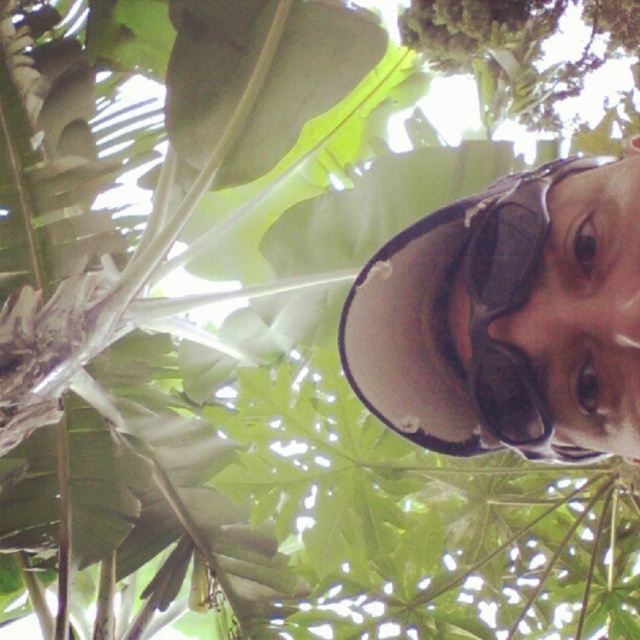
Question: Which object appears closest to the camera in this image?

Choices:
 (A) black matte goggles at upper right
 (B) white matte hat at upper center

Answer: (B)

Question: Is white matte hat at upper center thinner than black matte goggles at upper right?

Choices:
 (A) no
 (B) yes

Answer: (A)

Question: Can you confirm if white matte hat at upper center is thinner than black matte goggles at upper right?

Choices:
 (A) no
 (B) yes

Answer: (A)

Question: Does white matte hat at upper center appear under black matte goggles at upper right?

Choices:
 (A) yes
 (B) no

Answer: (A)